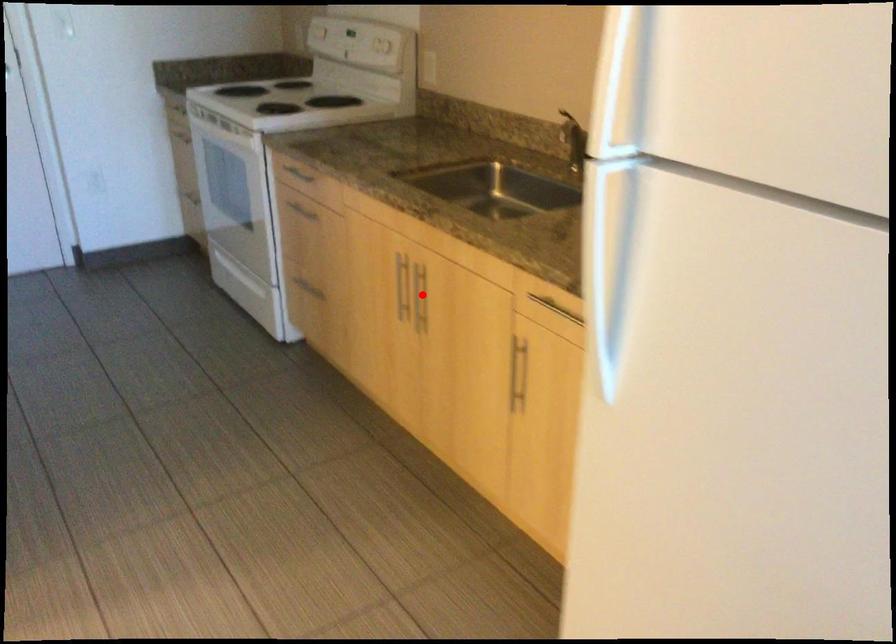
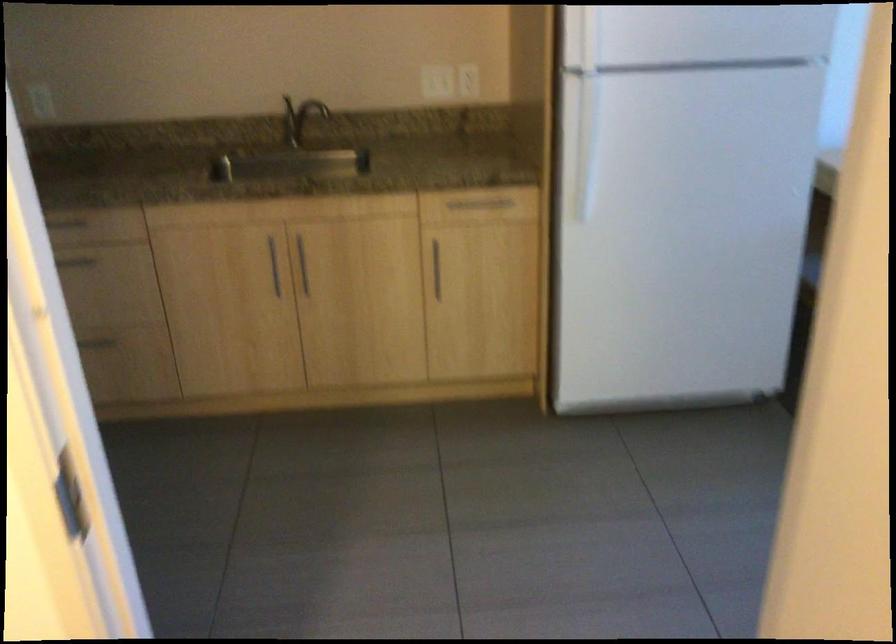
In the second image, find the point that corresponds to the highlighted location in the first image.

(303, 265)